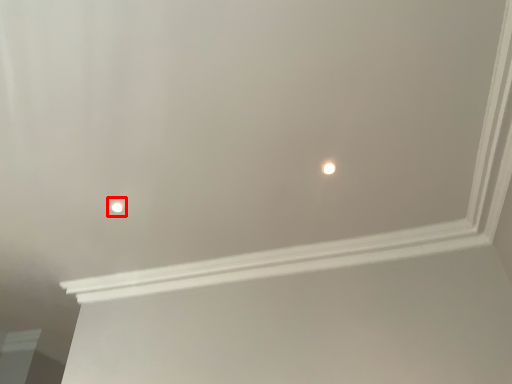
Question: From the image's perspective, considering the relative positions of light (annotated by the red box) and light in the image provided, where is light (annotated by the red box) located with respect to the staircase?

Choices:
 (A) below
 (B) above

Answer: (A)